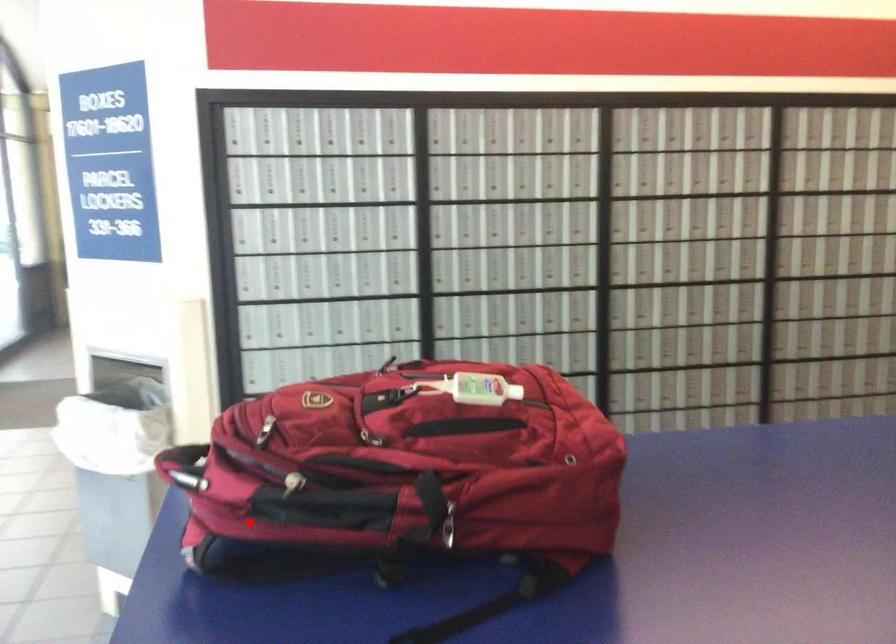
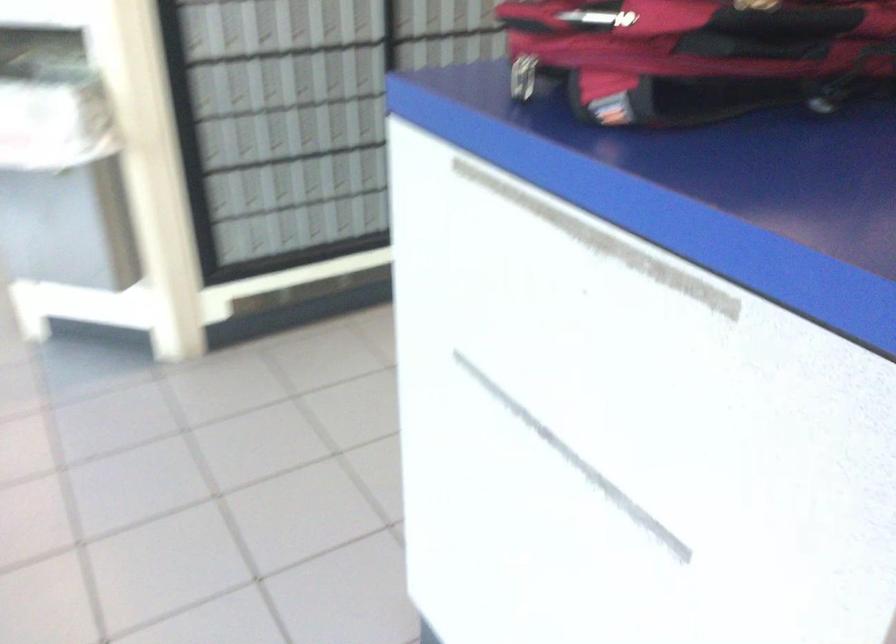
The point at the highlighted location is marked in the first image. Where is the corresponding point in the second image?

(696, 55)